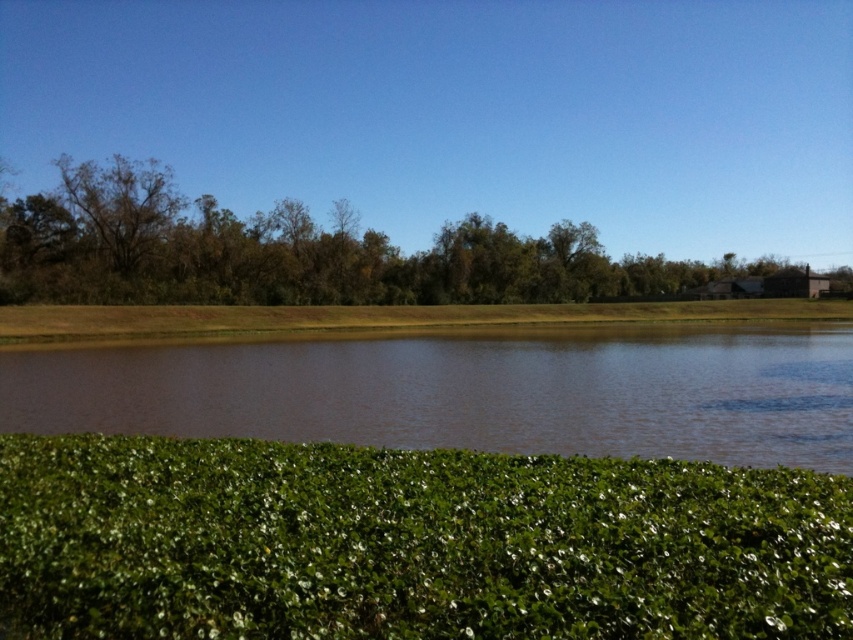
Based on the coordinates provided, what object is located at point (x=303, y=253) in the image?

The point (x=303, y=253) indicates green leafy trees at upper center.